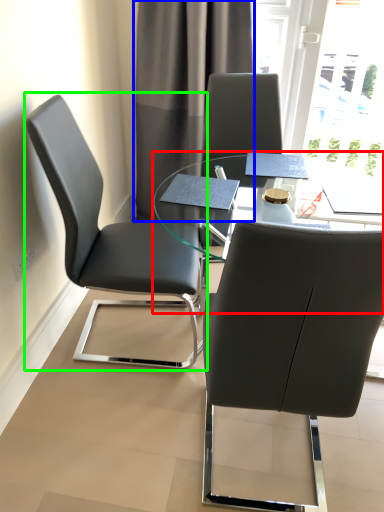
Question: Considering the real-world distances, which object is farthest from table (highlighted by a red box)? curtain (highlighted by a blue box) or chair (highlighted by a green box)?

Choices:
 (A) curtain
 (B) chair

Answer: (A)